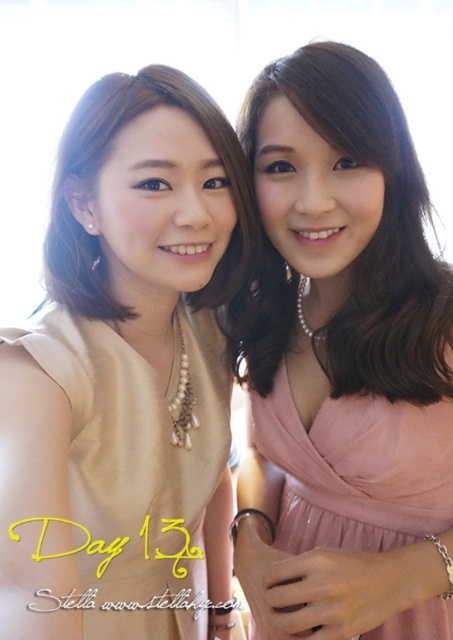
You are a photographer setting up for a group photo. You see the matte beige dress at center and the pink satin dress at right. Which dress is positioned higher in the frame?

The matte beige dress at center is located above the pink satin dress at right, so it is positioned higher in the frame.

You are a photographer adjusting the focus on your camera. You want to ensure both the matte beige dress at center and the matte gold necklace at upper left are in sharp focus. Given their sizes, which object should you prioritize focusing on first?

The matte beige dress at center is bigger than the matte gold necklace at upper left, so you should prioritize focusing on the matte beige dress at center first because larger objects often require more precise focus to maintain sharpness across their entire surface.

You are a photographer setting up a shot for two models wearing pink satin dresses. You notice the pink satin dress at center and the pink satin dress at right. Which dress should you adjust to ensure both dresses are at the same height in the frame?

The pink satin dress at right is shorter than the pink satin dress at center, so you should raise the pink satin dress at right to match the height of the pink satin dress at center.